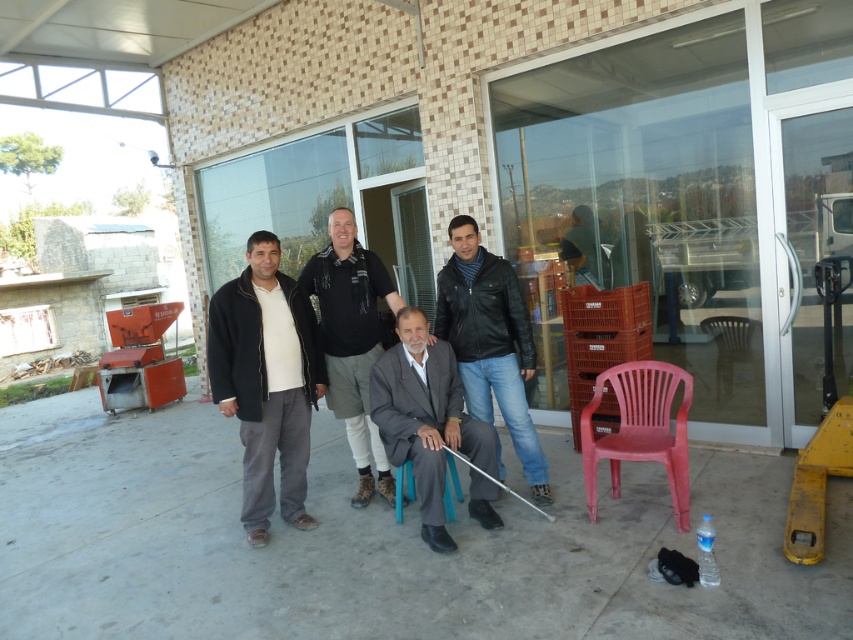
Question: Does dark gray suit at center have a lesser width compared to blue fabric chair at center?

Choices:
 (A) no
 (B) yes

Answer: (A)

Question: Can you confirm if dark gray cotton pants at left is positioned above dark gray suit at center?

Choices:
 (A) no
 (B) yes

Answer: (B)

Question: Which object is closer to the camera taking this photo?

Choices:
 (A) red plastic chair at right
 (B) dark gray suit at center
 (C) dark gray cotton pants at left
 (D) black leather jacket at center

Answer: (A)

Question: From the image, what is the correct spatial relationship of dark gray cotton pants at left in relation to red plastic chair at right?

Choices:
 (A) left
 (B) right

Answer: (A)

Question: Which object is farther from the camera taking this photo?

Choices:
 (A) red plastic chair at right
 (B) leather jacket at center

Answer: (B)

Question: Which of the following is the closest to the observer?

Choices:
 (A) blue fabric chair at center
 (B) dark gray suit at center
 (C) dark gray cotton pants at left

Answer: (B)